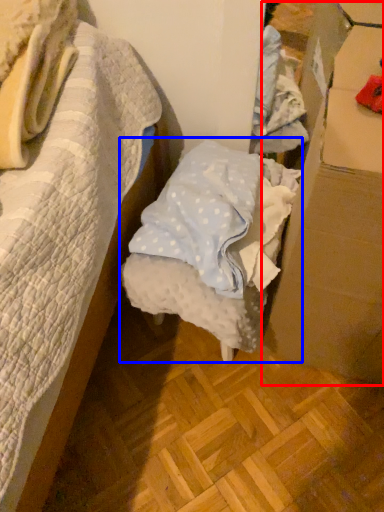
Question: Which object appears farthest to the camera in this image, cardboard box (highlighted by a red box) or furniture (highlighted by a blue box)?

Choices:
 (A) cardboard box
 (B) furniture

Answer: (B)